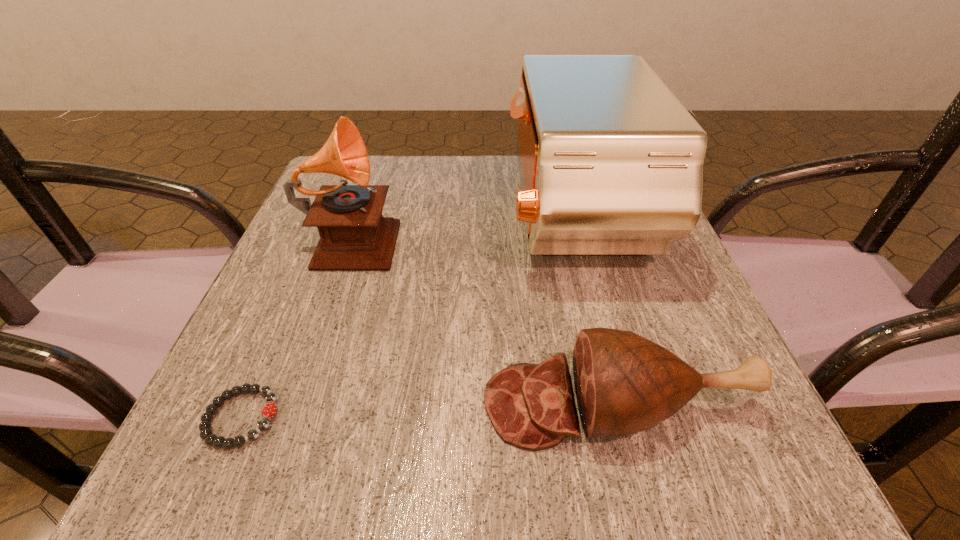
At what (x,y) coordinates should I click in order to perform the action: click on free space located 0.210m at the sliced end of the third tallest object. Please return your answer as a coordinate pair (x, y). This screenshot has width=960, height=540. Looking at the image, I should click on 331,404.

Where is `vacant space positioned 0.360m on the right of the shortest object`? vacant space positioned 0.360m on the right of the shortest object is located at coordinates (545, 418).

I want to click on toaster oven at the far edge, so click(611, 163).

Locate an element on the screen. This screenshot has width=960, height=540. phonograph record at the far edge is located at coordinates (354, 236).

Locate an element on the screen. Image resolution: width=960 pixels, height=540 pixels. ham that is at the near edge is located at coordinates (624, 383).

Where is `bracelet that is at the near edge`? bracelet that is at the near edge is located at coordinates (269, 410).

Where is `phonograph record located in the left edge section of the desktop`? Image resolution: width=960 pixels, height=540 pixels. phonograph record located in the left edge section of the desktop is located at coordinates (354, 236).

At what (x,y) coordinates should I click in order to perform the action: click on bracelet located at the left edge. Please return your answer as a coordinate pair (x, y). Looking at the image, I should click on pos(269,410).

You are a GUI agent. You are given a task and a screenshot of the screen. Output one action in this format:
    pyautogui.click(x=<x>, y=<y>)
    Task: Click on the toaster oven at the right edge
    This screenshot has width=960, height=540.
    Given the screenshot: What is the action you would take?
    pyautogui.click(x=611, y=163)

At what (x,y) coordinates should I click in order to perform the action: click on ham at the right edge. Please return your answer as a coordinate pair (x, y). This screenshot has width=960, height=540. Looking at the image, I should click on click(x=624, y=383).